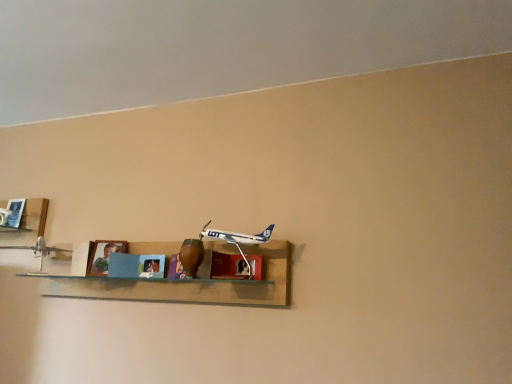
Image resolution: width=512 pixels, height=384 pixels. I want to click on white plastic airplane at center, acting as the 1th toy starting from the front, so click(238, 239).

Find the location of a particular element. metallic silver airplane at left, arranged as the 1th toy when viewed from the left is located at coordinates (37, 252).

Which is correct: matte wood cabinet at center is inside metallic silver airplane at left, arranged as the 1th toy when viewed from the left, or outside of it?

matte wood cabinet at center cannot be found inside metallic silver airplane at left, arranged as the 1th toy when viewed from the left.

Is matte wood cabinet at center beside metallic silver airplane at left, which is the 2th toy in front-to-back order?

matte wood cabinet at center is not next to metallic silver airplane at left, which is the 2th toy in front-to-back order, and they're not touching.

You are a GUI agent. You are given a task and a screenshot of the screen. Output one action in this format:
    pyautogui.click(x=<x>, y=<y>)
    Task: Click on the cabinet on the right of metallic silver airplane at left, the 1th toy positioned from the back
    Image resolution: width=512 pixels, height=384 pixels.
    Given the screenshot: What is the action you would take?
    pyautogui.click(x=228, y=266)

How far apart are matte wood cabinet at center and wooden shelf at center, the second shelf viewed from the left?

They are 12.00 inches apart.

From the image's perspective, which is above, matte wood cabinet at center or wooden shelf at center, the first shelf viewed from the right?

matte wood cabinet at center appears higher in the image.

Is point (213, 252) farther from viewer compared to point (31, 269)?

No, it is in front of (31, 269).

How different are the orientations of matte wood cabinet at center and wooden shelf at center, the second shelf viewed from the left, in degrees?

The angular difference between matte wood cabinet at center and wooden shelf at center, the second shelf viewed from the left, is 5.61 degrees.

From a real-world perspective, who is located higher, white plastic airplane at center, arranged as the 2th toy when viewed from the back, or matte wood cabinet at center?

white plastic airplane at center, arranged as the 2th toy when viewed from the back, is physically above.

Does white plastic airplane at center, the second toy when ordered from left to right, have a greater height compared to matte wood cabinet at center?

Indeed, white plastic airplane at center, the second toy when ordered from left to right, has a greater height compared to matte wood cabinet at center.

Is the surface of white plastic airplane at center, acting as the 1th toy starting from the front, in direct contact with matte wood cabinet at center?

Yes, white plastic airplane at center, acting as the 1th toy starting from the front, and matte wood cabinet at center clearly make contact.

Which is more to the left, metallic silver airplane at left, arranged as the 1th toy when viewed from the left, or white plastic airplane at center, arranged as the 2th toy when viewed from the back?

metallic silver airplane at left, arranged as the 1th toy when viewed from the left, is more to the left.

From their relative heights in the image, would you say metallic silver airplane at left, arranged as the 1th toy when viewed from the left, is taller or shorter than white plastic airplane at center, acting as the 1th toy starting from the right?

Considering their sizes, metallic silver airplane at left, arranged as the 1th toy when viewed from the left, has less height than white plastic airplane at center, acting as the 1th toy starting from the right.

How many degrees apart are the facing directions of metallic silver airplane at left, the 1th toy positioned from the back, and white plastic airplane at center, arranged as the 2th toy when viewed from the back?

metallic silver airplane at left, the 1th toy positioned from the back, and white plastic airplane at center, arranged as the 2th toy when viewed from the back, are facing 6.02 degrees away from each other.

Could you tell me if metallic silver airplane at left, which is the 2th toy from right to left, is facing white plastic airplane at center, acting as the 1th toy starting from the front?

No, metallic silver airplane at left, which is the 2th toy from right to left, is not oriented towards white plastic airplane at center, acting as the 1th toy starting from the front.

Would you say wooden shelf at left, the 1th shelf when ordered from left to right, is inside or outside wooden shelf at center, the first shelf viewed from the right?

wooden shelf at left, the 1th shelf when ordered from left to right, lies outside wooden shelf at center, the first shelf viewed from the right.

You are a GUI agent. You are given a task and a screenshot of the screen. Output one action in this format:
    pyautogui.click(x=<x>, y=<y>)
    Task: Click on the shelf lying below the wooden shelf at left, the 1th shelf when ordered from left to right (from the image's perspective)
    Image resolution: width=512 pixels, height=384 pixels.
    Given the screenshot: What is the action you would take?
    pyautogui.click(x=137, y=269)

Looking at their sizes, would you say wooden shelf at left, the 2th shelf when ordered from right to left, is wider or thinner than wooden shelf at center, the first shelf viewed from the right?

In the image, wooden shelf at left, the 2th shelf when ordered from right to left, appears to be more narrow than wooden shelf at center, the first shelf viewed from the right.

Does wooden shelf at left, the 1th shelf when ordered from left to right, turn towards wooden shelf at center, the second shelf viewed from the left?

No, wooden shelf at left, the 1th shelf when ordered from left to right, is not facing towards wooden shelf at center, the second shelf viewed from the left.

Is there a large distance between blue matte picture frame at center and white plastic airplane at center, acting as the 1th toy starting from the front?

No, blue matte picture frame at center is not far away from white plastic airplane at center, acting as the 1th toy starting from the front.

Is point (115, 250) farther from viewer compared to point (248, 236)?

Yes, point (115, 250) is behind point (248, 236).

Is blue matte picture frame at center at the left side of white plastic airplane at center, acting as the 1th toy starting from the front?

Correct, you'll find blue matte picture frame at center to the left of white plastic airplane at center, acting as the 1th toy starting from the front.

From the image's perspective, which is below, blue matte picture frame at center or white plastic airplane at center, the second toy when ordered from left to right?

From the image's view, blue matte picture frame at center is below.

This screenshot has width=512, height=384. I want to click on shelf on the right of the blue matte picture frame at center, so click(x=137, y=269).

Is wooden shelf at center, the second shelf viewed from the left, oriented towards blue matte picture frame at center?

Yes, wooden shelf at center, the second shelf viewed from the left, is oriented towards blue matte picture frame at center.

Which of these two, wooden shelf at center, the second shelf viewed from the left, or blue matte picture frame at center, stands shorter?

With less height is blue matte picture frame at center.

What are the coordinates of `cabinet lying on the right of metallic silver airplane at left, the 1th toy positioned from the back` in the screenshot? It's located at (228, 266).

The height and width of the screenshot is (384, 512). I want to click on cabinet behind the wooden shelf at center, the second shelf viewed from the left, so click(228, 266).

Considering their positions, is wooden shelf at left, the 2th shelf when ordered from right to left, positioned closer to white plastic airplane at center, arranged as the 2th toy when viewed from the back, than matte wood cabinet at center?

matte wood cabinet at center lies closer to white plastic airplane at center, arranged as the 2th toy when viewed from the back, than the other object.

Estimate the real-world distances between objects in this image. Which object is further from metallic silver airplane at left, the 1th toy positioned from the back, wooden shelf at left, the 1th shelf when ordered from left to right, or blue matte picture frame at center?

blue matte picture frame at center is positioned further to the anchor metallic silver airplane at left, the 1th toy positioned from the back.

Estimate the real-world distances between objects in this image. Which object is further from wooden shelf at center, the first shelf viewed from the right, metallic silver airplane at left, arranged as the 1th toy when viewed from the left, or blue matte picture frame at center?

The object further to wooden shelf at center, the first shelf viewed from the right, is metallic silver airplane at left, arranged as the 1th toy when viewed from the left.

In the scene shown: Which object lies nearer to the anchor point white plastic airplane at center, acting as the 1th toy starting from the right, blue matte picture frame at center or matte wood cabinet at center?

matte wood cabinet at center is closer to white plastic airplane at center, acting as the 1th toy starting from the right.

Estimate the real-world distances between objects in this image. Which object is closer to wooden shelf at center, the second shelf viewed from the left, metallic silver airplane at left, arranged as the 1th toy when viewed from the left, or wooden shelf at left, the 1th shelf when ordered from left to right?

metallic silver airplane at left, arranged as the 1th toy when viewed from the left, is closer to wooden shelf at center, the second shelf viewed from the left.

When comparing their distances from wooden shelf at center, the second shelf viewed from the left, does wooden shelf at left, the 1th shelf when ordered from left to right, or white plastic airplane at center, the second toy when ordered from left to right, seem closer?

white plastic airplane at center, the second toy when ordered from left to right, lies closer to wooden shelf at center, the second shelf viewed from the left, than the other object.

Estimate the real-world distances between objects in this image. Which object is further from white plastic airplane at center, acting as the 1th toy starting from the front, wooden shelf at center, the first shelf viewed from the right, or metallic silver airplane at left, which is the 2th toy in front-to-back order?

The object further to white plastic airplane at center, acting as the 1th toy starting from the front, is metallic silver airplane at left, which is the 2th toy in front-to-back order.

From the image, which object appears to be nearer to white plastic airplane at center, acting as the 1th toy starting from the right, metallic silver airplane at left, arranged as the 1th toy when viewed from the left, or wooden shelf at center, the second shelf viewed from the left?

wooden shelf at center, the second shelf viewed from the left, is positioned closer to the anchor white plastic airplane at center, acting as the 1th toy starting from the right.

In order to click on shelf located between metallic silver airplane at left, arranged as the 1th toy when viewed from the left, and white plastic airplane at center, acting as the 1th toy starting from the right, in the left-right direction in this screenshot , I will do `click(137, 269)`.

The height and width of the screenshot is (384, 512). What are the coordinates of `toy between blue matte picture frame at center and matte wood cabinet at center` in the screenshot? It's located at (238, 239).

The image size is (512, 384). Find the location of `toy situated between wooden shelf at left, the 2th shelf when ordered from right to left, and white plastic airplane at center, arranged as the 2th toy when viewed from the back, from left to right`. toy situated between wooden shelf at left, the 2th shelf when ordered from right to left, and white plastic airplane at center, arranged as the 2th toy when viewed from the back, from left to right is located at coordinates (37, 252).

This screenshot has height=384, width=512. Find the location of `toy between wooden shelf at left, the 2th shelf when ordered from right to left, and blue matte picture frame at center`. toy between wooden shelf at left, the 2th shelf when ordered from right to left, and blue matte picture frame at center is located at coordinates (37, 252).